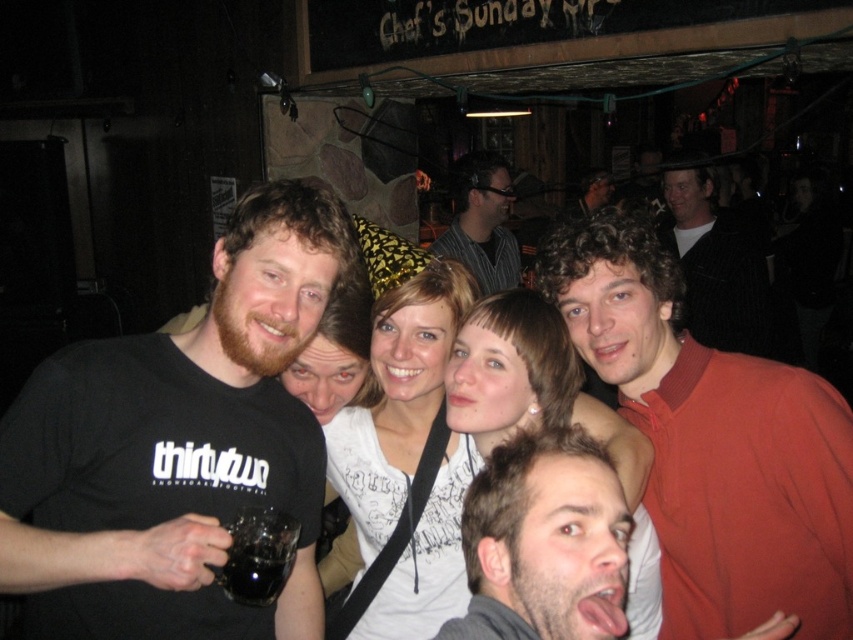
Question: Can you confirm if matte red polo shirt at center is bigger than dark brown hair at center?

Choices:
 (A) no
 (B) yes

Answer: (B)

Question: Can you confirm if black matte t-shirt at left is positioned to the left of black textured jacket at upper right?

Choices:
 (A) no
 (B) yes

Answer: (B)

Question: Which point is farther from the camera taking this photo?

Choices:
 (A) (624, 241)
 (B) (666, 202)
 (C) (503, 266)

Answer: (B)

Question: Can you confirm if black matte t-shirt at left is bigger than black textured jacket at upper right?

Choices:
 (A) no
 (B) yes

Answer: (A)

Question: Which point is farther to the camera?

Choices:
 (A) matte black shirt at center
 (B) black matte t-shirt at left

Answer: (A)

Question: Considering the real-world distances, which object is farthest from the black textured jacket at upper right?

Choices:
 (A) black matte t-shirt at left
 (B) matte red polo shirt at center
 (C) matte black shirt at center

Answer: (C)